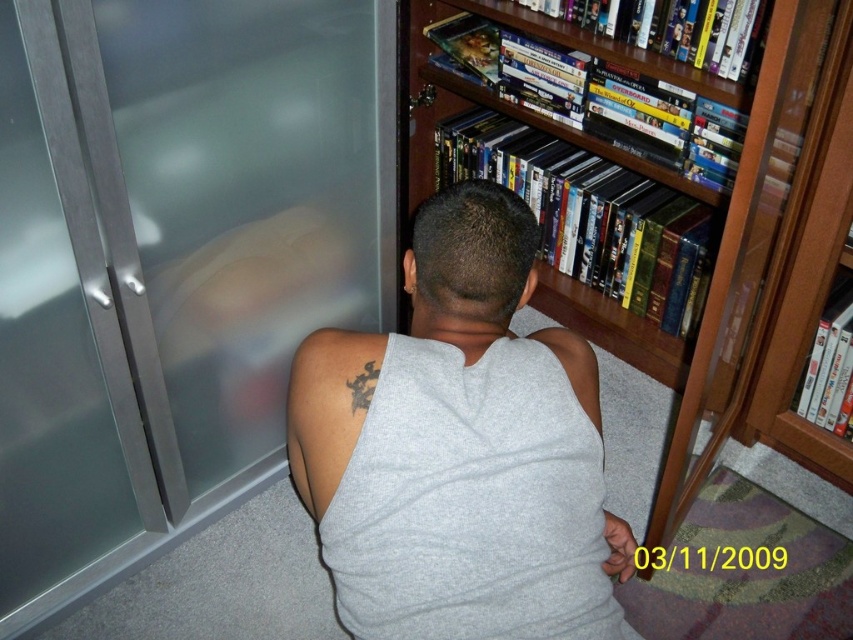
Question: Which point is farther to the camera?

Choices:
 (A) (552, 627)
 (B) (328, 58)
 (C) (347, 385)
 (D) (787, 109)

Answer: (B)

Question: Which point is closer to the camera taking this photo?

Choices:
 (A) (357, 388)
 (B) (718, 358)
 (C) (460, 465)

Answer: (C)

Question: Can you confirm if gray cotton tank top at center is positioned above black ink tattoo at upper back?

Choices:
 (A) no
 (B) yes

Answer: (A)

Question: Which of the following is the farthest from the observer?

Choices:
 (A) (437, 413)
 (B) (345, 385)

Answer: (B)

Question: Is frosted glass door at left above black ink tattoo at upper back?

Choices:
 (A) yes
 (B) no

Answer: (A)

Question: Is the position of gray cotton tank top at center less distant than that of wooden bookshelf at upper right?

Choices:
 (A) no
 (B) yes

Answer: (B)